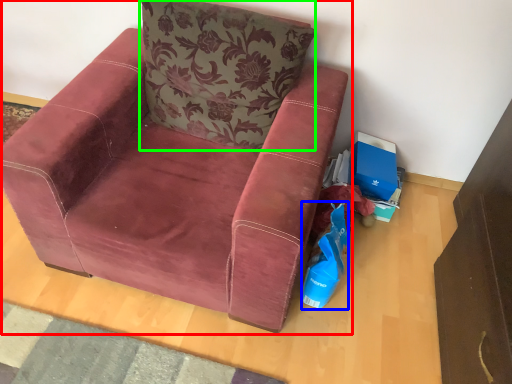
Question: Which object is positioned farthest from chair (highlighted by a red box)? Select from shopping bag (highlighted by a blue box) and pillow (highlighted by a green box).

Choices:
 (A) shopping bag
 (B) pillow

Answer: (A)